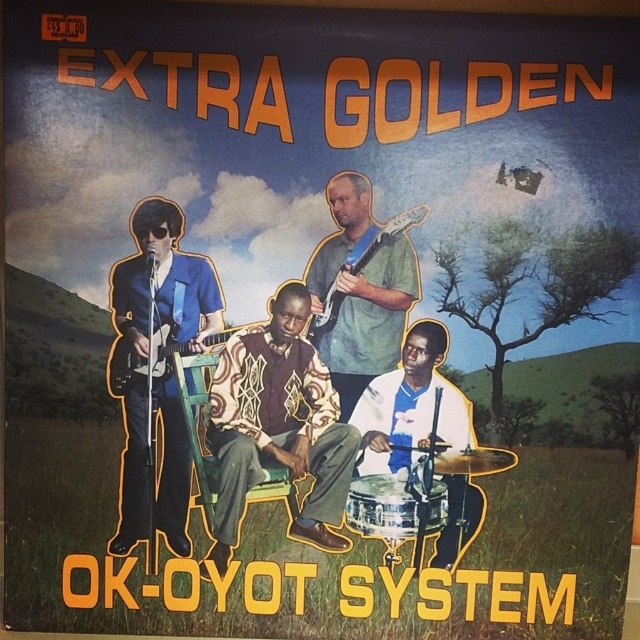
Question: Is green matte guitar at center positioned behind shiny metallic drum at lower center?

Choices:
 (A) yes
 (B) no

Answer: (B)

Question: In this image, where is patterned fabric shirt at center located relative to wooden chair at center?

Choices:
 (A) above
 (B) below

Answer: (B)

Question: Estimate the real-world distances between objects in this image. Which object is farther from the wooden chair at center?

Choices:
 (A) patterned fabric shirt at center
 (B) shiny metallic drum at lower center
 (C) green matte guitar at center
 (D) white fabric shirt at center

Answer: (B)

Question: Estimate the real-world distances between objects in this image. Which object is closer to the wooden chair at center?

Choices:
 (A) shiny metallic drum at lower center
 (B) green matte guitar at center

Answer: (B)

Question: Can you confirm if patterned fabric shirt at center is wider than matte blue suit at left?

Choices:
 (A) no
 (B) yes

Answer: (B)

Question: Which point appears closest to the camera in this image?

Choices:
 (A) (192, 266)
 (B) (323, 404)

Answer: (A)